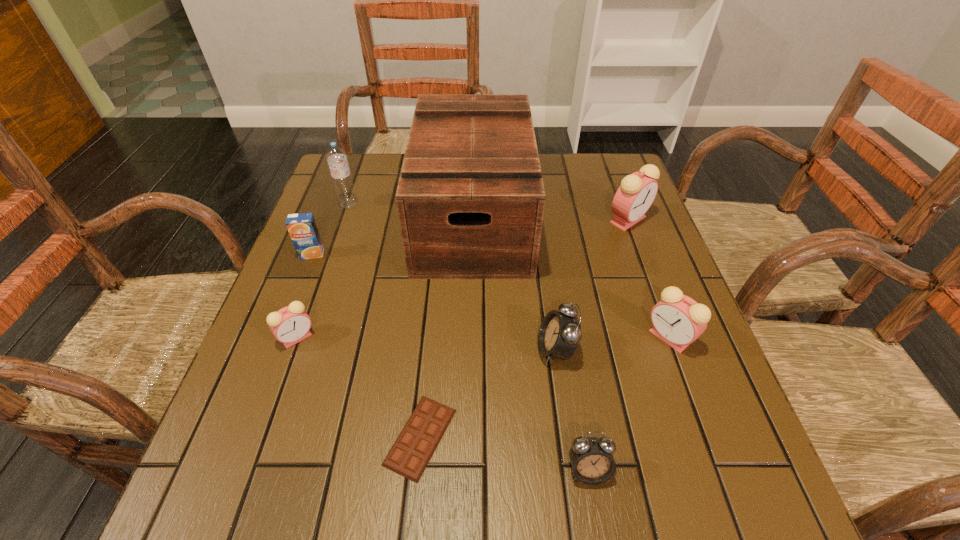
Image resolution: width=960 pixels, height=540 pixels. I want to click on box, so click(470, 199).

Locate an element on the screen. The image size is (960, 540). the second tallest object is located at coordinates (337, 160).

You are a GUI agent. You are given a task and a screenshot of the screen. Output one action in this format:
    pyautogui.click(x=<x>, y=<y>)
    Task: Click on the farthest alarm clock
    The image size is (960, 540).
    Given the screenshot: What is the action you would take?
    pyautogui.click(x=637, y=191)

I want to click on the farthest pink alarm clock, so click(x=637, y=191).

This screenshot has height=540, width=960. In order to click on the second biggest pink alarm clock in this screenshot , I will do `click(678, 320)`.

Locate an element on the screen. the farther white alarm clock is located at coordinates (559, 335).

Locate an element on the screen. The height and width of the screenshot is (540, 960). orange_juice is located at coordinates (302, 227).

This screenshot has width=960, height=540. I want to click on the smallest pink alarm clock, so click(290, 325).

Locate an element on the screen. Image resolution: width=960 pixels, height=540 pixels. the leftmost alarm clock is located at coordinates (290, 325).

Identify the location of the nearer white alarm clock. Image resolution: width=960 pixels, height=540 pixels. (592, 461).